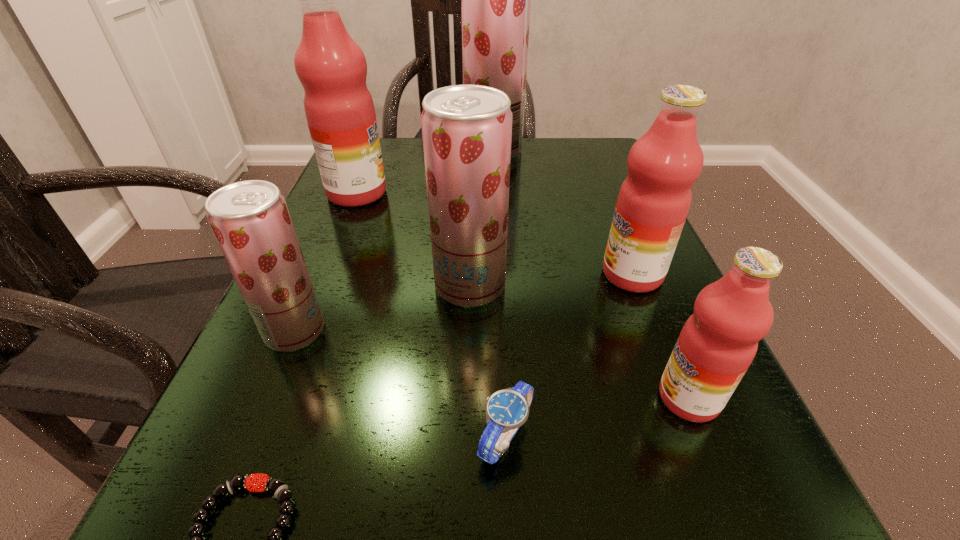
This screenshot has width=960, height=540. I want to click on the third closest fruit juice relative to the biggest pink fruit juice, so click(x=250, y=220).

Locate which strawberry fruit juice is the closest to the smallest strawberry fruit juice. Please provide its 2D coordinates. Your answer should be formatted as a tuple, i.e. [(x, y)], where the tuple contains the x and y coordinates of a point satisfying the conditions above.

[(467, 129)]

In order to click on strawberry fruit juice that is the second closest to the second biggest strawberry fruit juice in this screenshot , I will do `click(495, 0)`.

Select which pink fruit juice appears as the closest to the second smallest strawberry fruit juice. Please provide its 2D coordinates. Your answer should be formatted as a tuple, i.e. [(x, y)], where the tuple contains the x and y coordinates of a point satisfying the conditions above.

[(663, 164)]

In order to click on pink fruit juice that is the closest one to the second smallest pink fruit juice in this screenshot , I will do `click(718, 342)`.

This screenshot has width=960, height=540. Find the location of `free spot that satisfies the following two spatial constraints: 1. on the label of the second biggest strawberry fruit juice; 2. on the left side of the farthest pink fruit juice`. free spot that satisfies the following two spatial constraints: 1. on the label of the second biggest strawberry fruit juice; 2. on the left side of the farthest pink fruit juice is located at coordinates (319, 285).

The image size is (960, 540). Identify the location of free region that satisfies the following two spatial constraints: 1. on the front side of the seventh tallest object; 2. on the right side of the leftmost strawberry fruit juice. (251, 436).